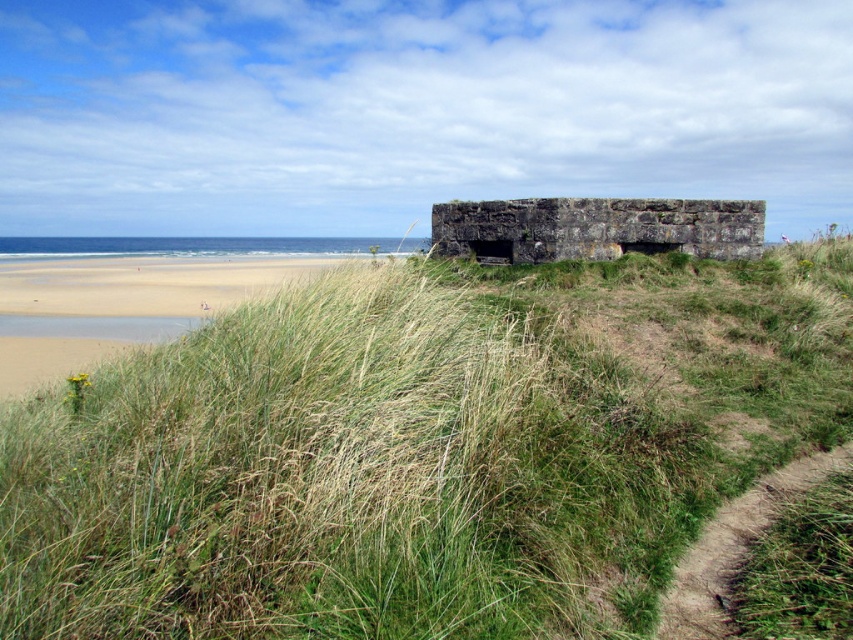
Question: Does green grassy at center have a smaller size compared to dirt/grass path at lower right?

Choices:
 (A) no
 (B) yes

Answer: (B)

Question: Observing the image, what is the correct spatial positioning of sandy beige sand at lower left in reference to dark gray stone bunker at center?

Choices:
 (A) right
 (B) left

Answer: (B)

Question: Which is farther from the dirt/grass path at lower right?

Choices:
 (A) dark gray stone bunker at center
 (B) sandy beige sand at lower left

Answer: (B)

Question: Which object appears farthest from the camera in this image?

Choices:
 (A) green grassy at center
 (B) dirt/grass path at lower right

Answer: (A)

Question: Which object appears farthest from the camera in this image?

Choices:
 (A) dark gray stone bunker at center
 (B) dirt/grass path at lower right
 (C) sandy beige sand at lower left
 (D) green grassy at center

Answer: (C)

Question: Observing the image, what is the correct spatial positioning of green grassy at center in reference to dirt/grass path at lower right?

Choices:
 (A) below
 (B) above

Answer: (B)